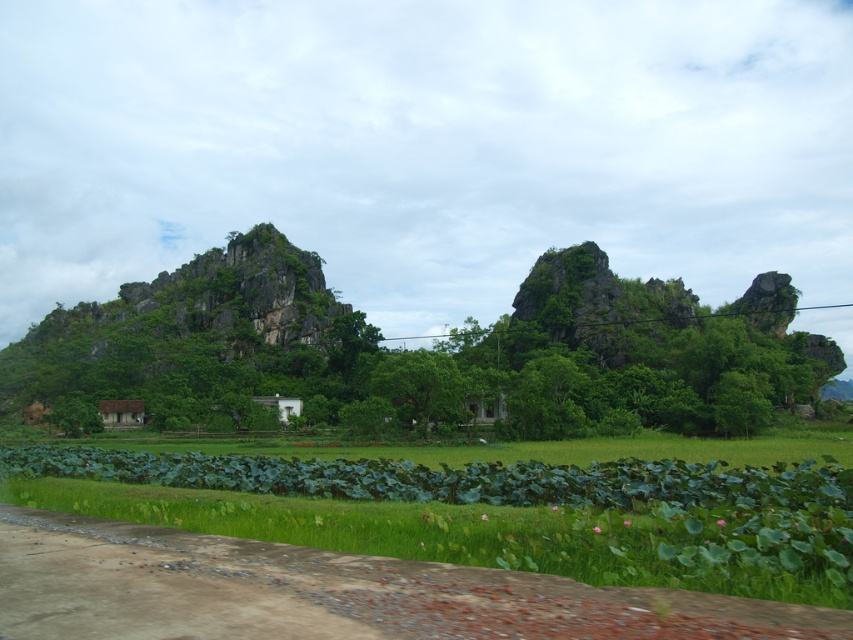
Is green grassy field at lower center to the left of rocky gray mountain at left from the viewer's perspective?

In fact, green grassy field at lower center is to the right of rocky gray mountain at left.

Is point (0, 480) farther from camera compared to point (123, 289)?

That is False.

Who is more forward, (782, 532) or (119, 376)?

Point (782, 532)

The image size is (853, 640). I want to click on green grassy field at lower center, so click(x=488, y=513).